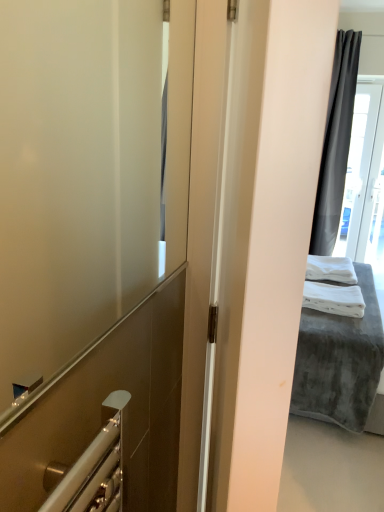
Question: Does white soft towel at right, placed as the second bath towel when sorted from back to front, have a larger size compared to transparent glass door at upper right?

Choices:
 (A) no
 (B) yes

Answer: (A)

Question: Is white soft towel at right, placed as the second bath towel when sorted from back to front, further to the viewer compared to transparent glass door at upper right?

Choices:
 (A) no
 (B) yes

Answer: (A)

Question: From a real-world perspective, does white soft towel at right, the first bath towel positioned from the front, stand above transparent glass door at upper right?

Choices:
 (A) yes
 (B) no

Answer: (B)

Question: Is white soft towel at right, the first bath towel positioned from the front, beside transparent glass door at upper right?

Choices:
 (A) yes
 (B) no

Answer: (B)

Question: From the image's perspective, is white soft towel at right, placed as the second bath towel when sorted from back to front, under transparent glass door at upper right?

Choices:
 (A) no
 (B) yes

Answer: (B)

Question: Is point (324, 284) positioned closer to the camera than point (327, 278)?

Choices:
 (A) closer
 (B) farther

Answer: (A)

Question: Is white soft towel at right, the first bath towel positioned from the front, taller or shorter than white soft bath towel at right, the second bath towel positioned from the front?

Choices:
 (A) short
 (B) tall

Answer: (A)

Question: Which is correct: white soft towel at right, placed as the second bath towel when sorted from back to front, is inside white soft bath towel at right, which is the first bath towel in back-to-front order, or outside of it?

Choices:
 (A) inside
 (B) outside

Answer: (B)

Question: From the image's perspective, is white soft towel at right, the first bath towel positioned from the front, located above or below white soft bath towel at right, the second bath towel positioned from the front?

Choices:
 (A) below
 (B) above

Answer: (A)

Question: From a real-world perspective, relative to white soft fabric bed at right, is white soft bath towel at right, the second bath towel positioned from the front, vertically above or below?

Choices:
 (A) below
 (B) above

Answer: (B)

Question: Visually, is white soft bath towel at right, which is the first bath towel in back-to-front order, positioned to the left or to the right of white soft fabric bed at right?

Choices:
 (A) left
 (B) right

Answer: (A)

Question: Considering their positions, is white soft bath towel at right, the second bath towel positioned from the front, located in front of or behind white soft fabric bed at right?

Choices:
 (A) behind
 (B) front

Answer: (A)

Question: In terms of height, does white soft bath towel at right, the second bath towel positioned from the front, look taller or shorter compared to white soft fabric bed at right?

Choices:
 (A) short
 (B) tall

Answer: (A)

Question: Considering the relative positions of white soft towel at right, the first bath towel positioned from the front, and transparent glass door at upper right in the image provided, is white soft towel at right, the first bath towel positioned from the front, to the left or to the right of transparent glass door at upper right?

Choices:
 (A) right
 (B) left

Answer: (B)

Question: Is point (327, 309) closer or farther from the camera than point (357, 186)?

Choices:
 (A) closer
 (B) farther

Answer: (A)